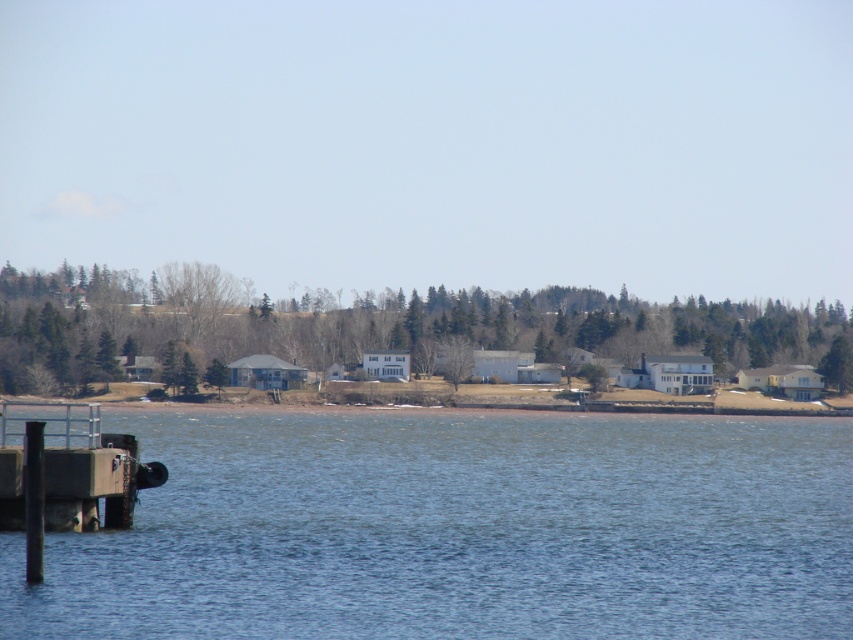
You are a delivery drone with a maximum flight range of 30 meters. You need to deliver a package from the blue water at lower left to the concrete dock at lower left. Can you complete the delivery without needing a recharge?

The distance between the blue water at lower left and the concrete dock at lower left is 25.27 meters, which is within your 30 meter range. Yes, you can complete the delivery without needing a recharge.

You are standing at the origin point of the image coordinate system. You want to reach the blue water at lower left. Which direction should you move in terms of x and y coordinates?

To reach the blue water at lower left, you should move towards the negative x and negative y direction since it is located at point (x=460, y=529). Wait, but lower left would typically be negative x and positive y? Hmm, maybe the coordinate system here is defined differently. Let me check the rules again. The user didn not specify the coordinate system, but in standard image coordinates, the origin is top left, so x increases to the right, y increases downward. So lower left would be high x? Wait no. Wait, in

You are standing on the concrete dock at lower left and want to see the blue water at lower left. In which direction should you look to see it?

The blue water at lower left is below the concrete dock at lower left, so you should look downward to see it.